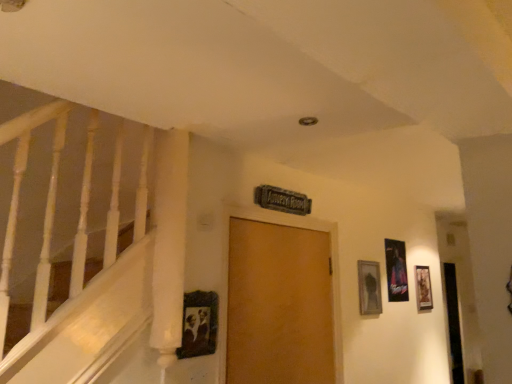
Question: Can you confirm if wooden picture frame at right, which ranks as the 1th picture frame in back-to-front order, is wider than wooden door at center?

Choices:
 (A) no
 (B) yes

Answer: (A)

Question: Is wooden picture frame at right, which ranks as the 1th picture frame in back-to-front order, taller than wooden door at center?

Choices:
 (A) no
 (B) yes

Answer: (A)

Question: From a real-world perspective, is wooden picture frame at right, which ranks as the 1th picture frame in back-to-front order, below wooden door at center?

Choices:
 (A) no
 (B) yes

Answer: (A)

Question: From a real-world perspective, is wooden picture frame at right, which ranks as the 1th picture frame in back-to-front order, positioned over wooden door at center based on gravity?

Choices:
 (A) no
 (B) yes

Answer: (B)

Question: Is wooden picture frame at right, which ranks as the 1th picture frame in back-to-front order, thinner than wooden door at center?

Choices:
 (A) no
 (B) yes

Answer: (B)

Question: Is wooden picture frame at right, which is the fourth picture frame from front to back, bigger than wooden door at center?

Choices:
 (A) no
 (B) yes

Answer: (A)

Question: Are wooden picture frame at upper right, the second picture frame when ordered from front to back, and wooden vintage frame at center, the fourth picture frame in the back-to-front sequence, far apart?

Choices:
 (A) no
 (B) yes

Answer: (B)

Question: From a real-world perspective, is wooden picture frame at upper right, the second picture frame when ordered from front to back, located beneath wooden vintage frame at center, the 1th picture frame viewed from the front?

Choices:
 (A) yes
 (B) no

Answer: (B)

Question: Can you confirm if wooden picture frame at upper right, the 2th picture frame positioned from the left, is smaller than wooden vintage frame at center, the 1th picture frame viewed from the front?

Choices:
 (A) no
 (B) yes

Answer: (A)

Question: Would you say wooden vintage frame at center, acting as the fourth picture frame starting from the right, is part of wooden picture frame at upper right, the second picture frame when ordered from front to back,'s contents?

Choices:
 (A) yes
 (B) no

Answer: (B)

Question: Can you confirm if wooden picture frame at upper right, the 2th picture frame positioned from the left, is shorter than wooden vintage frame at center, the fourth picture frame in the back-to-front sequence?

Choices:
 (A) yes
 (B) no

Answer: (B)

Question: Is wooden picture frame at upper right, arranged as the third picture frame when viewed from the back, further to the viewer compared to wooden vintage frame at center, acting as the fourth picture frame starting from the right?

Choices:
 (A) yes
 (B) no

Answer: (A)

Question: Is metallic silver picture frame at right, the second picture frame in the right-to-left sequence, wider than wooden picture frame at right, acting as the 4th picture frame starting from the left?

Choices:
 (A) no
 (B) yes

Answer: (A)